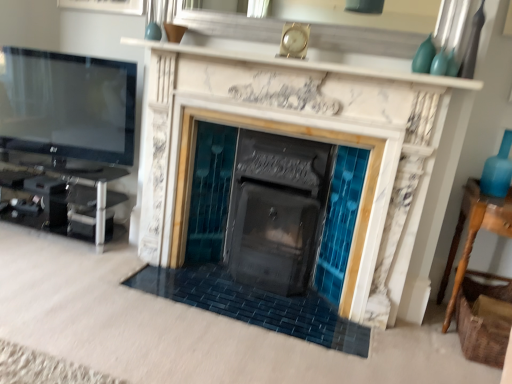
Locate an element on the screen. free spot to the left of matte glass vase at upper right, positioned as the 2th turquoise in front-to-back order is located at coordinates (394, 69).